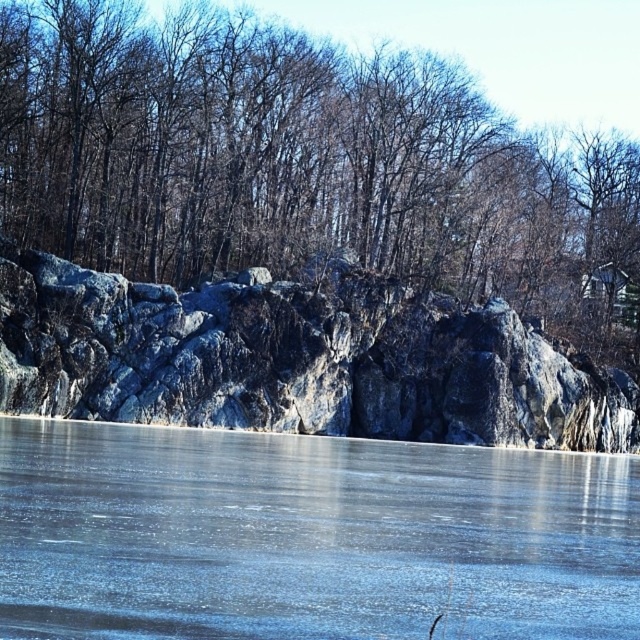
Question: Which of the following is the closest to the observer?

Choices:
 (A) (420, 228)
 (B) (33, 378)

Answer: (B)

Question: Does dark brown bark tree at upper center have a smaller size compared to transparent ice at center?

Choices:
 (A) yes
 (B) no

Answer: (B)

Question: Based on their relative distances, which object is nearer to the granite rock formation at center?

Choices:
 (A) transparent ice at center
 (B) dark brown bark tree at upper center

Answer: (B)

Question: Which of the following is the closest to the observer?

Choices:
 (A) (484, 573)
 (B) (256, 97)

Answer: (A)

Question: Considering the relative positions of dark brown bark tree at upper center and granite rock formation at center in the image provided, where is dark brown bark tree at upper center located with respect to granite rock formation at center?

Choices:
 (A) left
 (B) right

Answer: (B)

Question: Does transparent ice at center have a lesser width compared to granite rock formation at center?

Choices:
 (A) yes
 (B) no

Answer: (A)